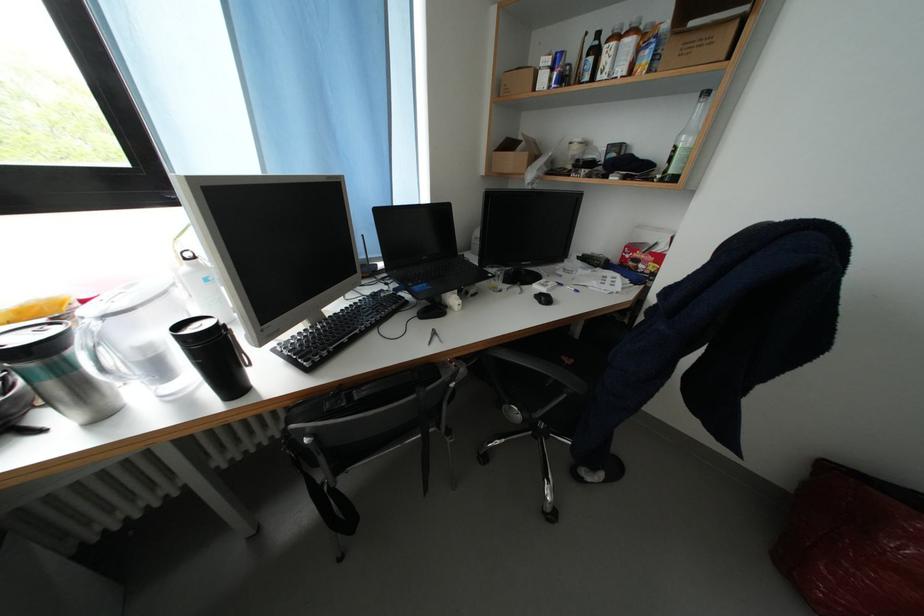
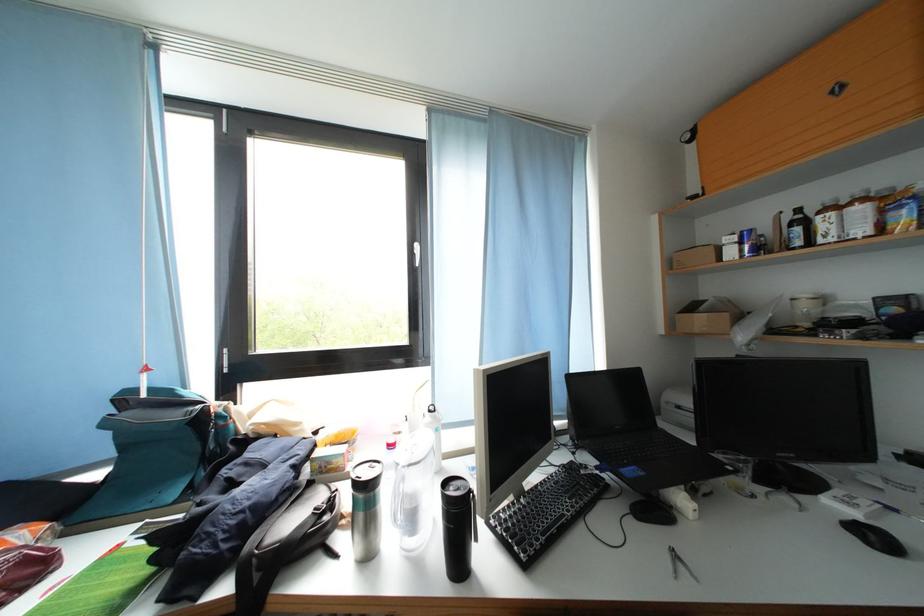
In the second image, find the point that corresponds to point (599, 65) in the first image.

(806, 233)